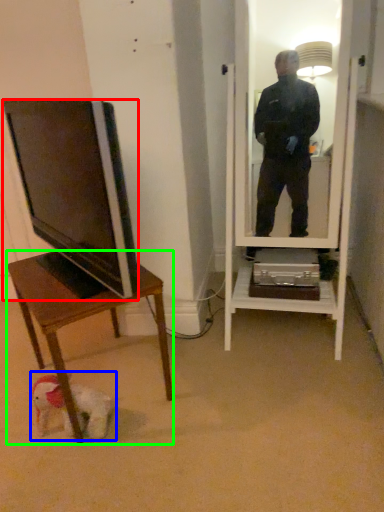
Question: Which object is positioned closest to television (highlighted by a red box)? Select from dog (highlighted by a blue box) and desk (highlighted by a green box).

Choices:
 (A) dog
 (B) desk

Answer: (B)